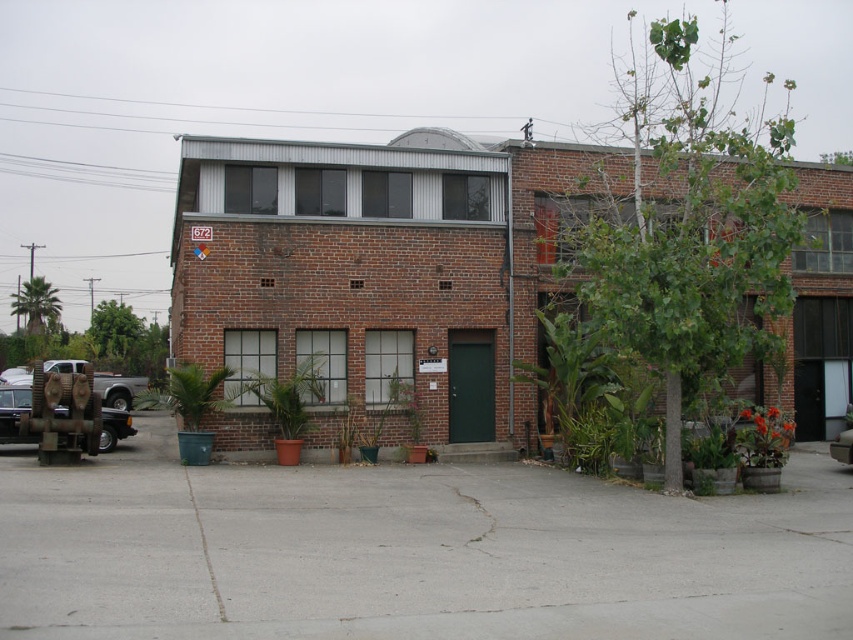
In the scene shown: You are a delivery person trying to park your metallic silver car at center in the parking lot in front of the building. There is a rusty metal truck at lower left already parked. Can your car fit between the truck and the building if the space between them is exactly the same as the truck width?

The rusty metal truck at lower left has a lesser width compared to metallic silver car at center. Therefore, the space between the truck and the building would not be sufficient for the car to fit since the car is wider than the truck.

You need to park your vehicle in the parking lot in front of the two story brick building. You have a compact car that is the same size as the rusty metal truck at lower left. Is there enough space between the metallic silver car at center and the building to park your compact car?

The rusty metal truck at lower left occupies less space than metallic silver car at center, so the compact car is smaller than the metallic silver car at center. Therefore, there is enough space between the metallic silver car at center and the building to park the compact car.

You are standing at the entrance of the two story brick building and want to place a new potted plant exactly at the center of the paved area in front of the building. Is the green matte plant at center already positioned there?

The green matte plant at center is located at point (283, 401), so it is already positioned at the center of the paved area in front of the building.